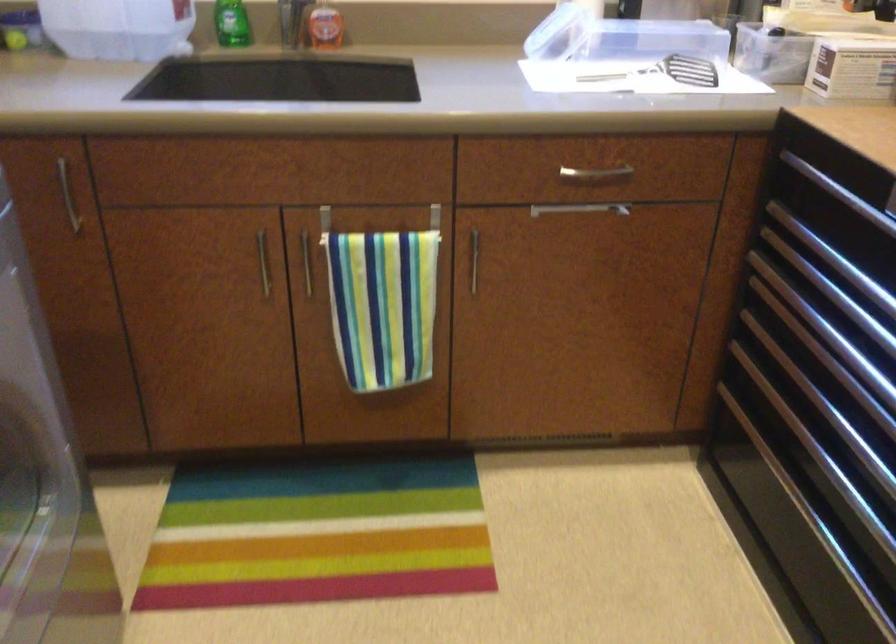
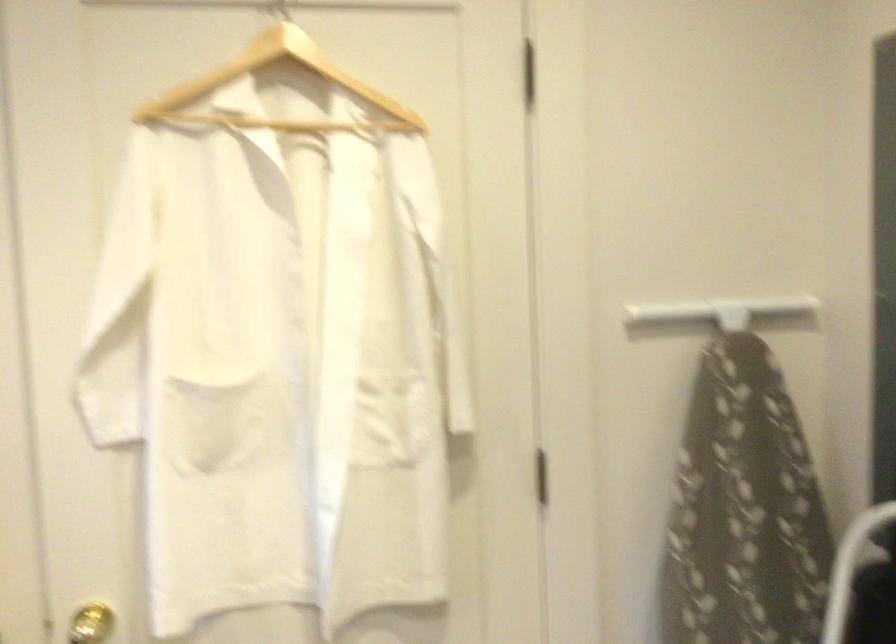
Question: The camera is either moving clockwise (left) or counter-clockwise (right) around the object. The first image is from the beginning of the video and the second image is from the end. Is the camera moving left or right when shooting the video?

Choices:
 (A) Left
 (B) Right

Answer: (A)